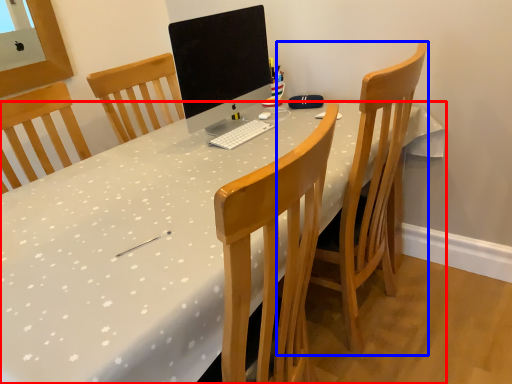
Question: Which of the following is the farthest to the observer, desk (highlighted by a red box) or chair (highlighted by a blue box)?

Choices:
 (A) desk
 (B) chair

Answer: (B)